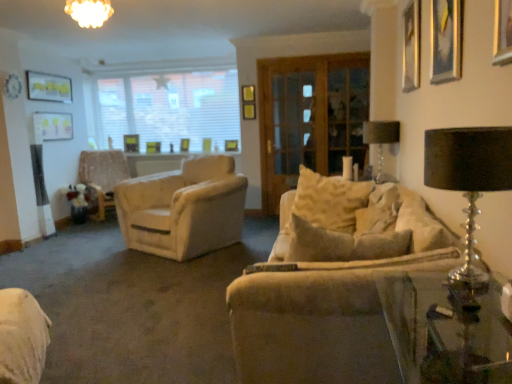
Question: Is gold metallic picture frame at upper left, positioned as the first picture frame in left-to-right order, far away from white blinds at upper center?

Choices:
 (A) yes
 (B) no

Answer: (A)

Question: From a real-world perspective, is gold metallic picture frame at upper left, positioned as the first picture frame in left-to-right order, beneath white blinds at upper center?

Choices:
 (A) yes
 (B) no

Answer: (B)

Question: Is gold metallic picture frame at upper left, the 5th picture frame in the right-to-left sequence, surrounding white blinds at upper center?

Choices:
 (A) no
 (B) yes

Answer: (A)

Question: Can you confirm if gold metallic picture frame at upper left, which ranks as the 3th picture frame in front-to-back order, is shorter than white blinds at upper center?

Choices:
 (A) yes
 (B) no

Answer: (A)

Question: Does gold metallic picture frame at upper left, the 3th picture frame positioned from the back, appear on the right side of white blinds at upper center?

Choices:
 (A) yes
 (B) no

Answer: (B)

Question: From a real-world perspective, relative to transparent glass table at lower right, is light beige fabric armchair at left vertically above or below?

Choices:
 (A) below
 (B) above

Answer: (A)

Question: Is point (124, 167) closer or farther from the camera than point (471, 339)?

Choices:
 (A) farther
 (B) closer

Answer: (A)

Question: Considering their positions, is light beige fabric armchair at left located in front of or behind transparent glass table at lower right?

Choices:
 (A) behind
 (B) front

Answer: (A)

Question: From their relative heights in the image, would you say light beige fabric armchair at left is taller or shorter than transparent glass table at lower right?

Choices:
 (A) tall
 (B) short

Answer: (A)

Question: Considering their positions, is wooden picture frame at upper left, the fifth picture frame positioned from the front, located in front of or behind metallic silver picture frame at upper right, positioned as the fourth picture frame in back-to-front order?

Choices:
 (A) front
 (B) behind

Answer: (B)

Question: In terms of width, does wooden picture frame at upper left, marked as the 1th picture frame in a back-to-front arrangement, look wider or thinner when compared to metallic silver picture frame at upper right, positioned as the fourth picture frame in back-to-front order?

Choices:
 (A) wide
 (B) thin

Answer: (A)

Question: Is point (138, 142) positioned closer to the camera than point (402, 36)?

Choices:
 (A) farther
 (B) closer

Answer: (A)

Question: Considering the positions of wooden picture frame at upper left, the fifth picture frame positioned from the front, and metallic silver picture frame at upper right, the 1th picture frame from the right, in the image, is wooden picture frame at upper left, the fifth picture frame positioned from the front, taller or shorter than metallic silver picture frame at upper right, the 1th picture frame from the right,?

Choices:
 (A) short
 (B) tall

Answer: (A)

Question: From a real-world perspective, is gold metallic picture frame at upper left, the 3th picture frame positioned from the back, positioned above or below metallic gold picture frame at upper right, which appears as the second picture frame when viewed from the right?

Choices:
 (A) below
 (B) above

Answer: (B)

Question: From the image's perspective, is gold metallic picture frame at upper left, the 3th picture frame positioned from the back, positioned above or below metallic gold picture frame at upper right, placed as the fourth picture frame when sorted from left to right?

Choices:
 (A) below
 (B) above

Answer: (B)